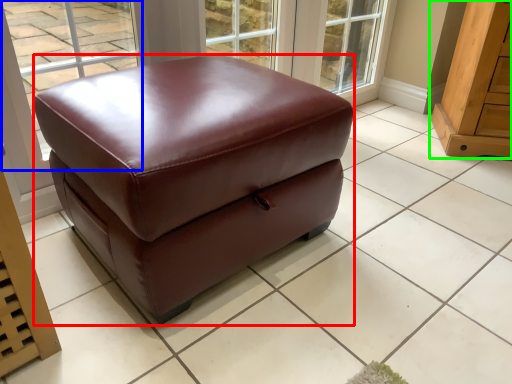
Question: Based on their relative distances, which object is nearer to furniture (highlighted by a red box)? Choose from window (highlighted by a blue box) and furniture (highlighted by a green box).

Choices:
 (A) window
 (B) furniture

Answer: (B)